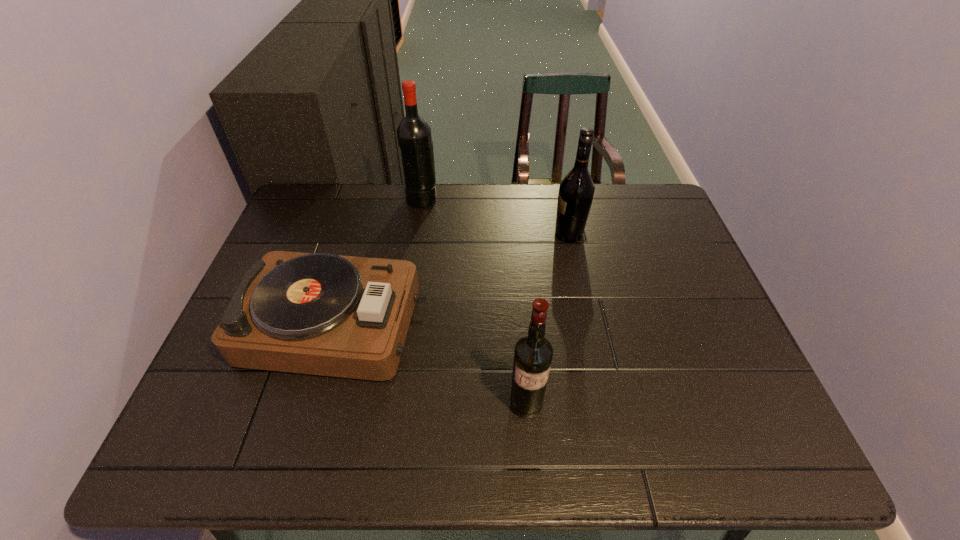
What are the coordinates of `free space located on the label of the rightmost wine bottle` in the screenshot? It's located at (502, 234).

Identify the location of free space located on the label of the rightmost wine bottle. (519, 234).

Identify the location of vacant space located 0.240m on the back of the record player. The width and height of the screenshot is (960, 540). (366, 220).

The width and height of the screenshot is (960, 540). In order to click on object that is at the left edge in this screenshot , I will do `click(322, 314)`.

In the image, there is a desktop. Where is `free space at the far edge`? The image size is (960, 540). free space at the far edge is located at coordinates (596, 228).

You are a GUI agent. You are given a task and a screenshot of the screen. Output one action in this format:
    pyautogui.click(x=<x>, y=<y>)
    Task: Click on the vacant space at the near edge of the desktop
    
    Given the screenshot: What is the action you would take?
    pyautogui.click(x=548, y=425)

I want to click on vacant region at the right edge of the desktop, so click(714, 363).

I want to click on blank space at the far left corner of the desktop, so click(x=316, y=221).

Identify the location of vacant space that is in between the second nearest wine bottle and the third farthest object. (452, 279).

Image resolution: width=960 pixels, height=540 pixels. Identify the location of vacant space that is in between the third nearest object and the farthest object. (495, 216).